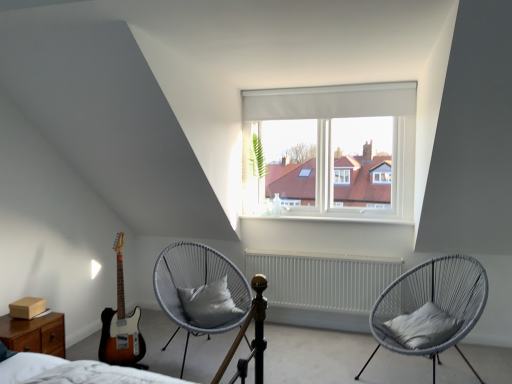
Question: Is sunburst wood guitar at left turned away from gray woven chair at center, the first chair when ordered from right to left?

Choices:
 (A) no
 (B) yes

Answer: (A)

Question: Does sunburst wood guitar at left contain gray woven chair at center, which is counted as the second chair, starting from the left?

Choices:
 (A) yes
 (B) no

Answer: (B)

Question: Does sunburst wood guitar at left lie in front of gray woven chair at center, the first chair when ordered from right to left?

Choices:
 (A) yes
 (B) no

Answer: (B)

Question: Is sunburst wood guitar at left oriented towards gray woven chair at center, the first chair when ordered from right to left?

Choices:
 (A) no
 (B) yes

Answer: (A)

Question: Does sunburst wood guitar at left have a greater height compared to gray woven chair at center, the first chair when ordered from right to left?

Choices:
 (A) yes
 (B) no

Answer: (A)

Question: Is point (182, 271) closer or farther from the camera than point (236, 311)?

Choices:
 (A) farther
 (B) closer

Answer: (A)

Question: From the image's perspective, relative to gray fabric pillow at center, marked as the 2th pillow in a right-to-left arrangement, is gray woven chair with cushion at center, acting as the 1th chair starting from the left, above or below?

Choices:
 (A) above
 (B) below

Answer: (B)

Question: In terms of width, does gray woven chair with cushion at center, acting as the 1th chair starting from the left, look wider or thinner when compared to gray fabric pillow at center, which is the 1th pillow in back-to-front order?

Choices:
 (A) wide
 (B) thin

Answer: (A)

Question: Is gray woven chair with cushion at center, acting as the 1th chair starting from the left, bigger or smaller than gray fabric pillow at center, which is the 1th pillow from left to right?

Choices:
 (A) small
 (B) big

Answer: (B)

Question: From the image's perspective, is gray fabric pillow at center, which is the 1th pillow from left to right, located above or below gray woven chair with cushion at center, the 2th chair when ordered from right to left?

Choices:
 (A) above
 (B) below

Answer: (A)

Question: From a real-world perspective, is gray fabric pillow at center, which is the 1th pillow in back-to-front order, positioned above or below gray woven chair with cushion at center, the 2th chair when ordered from right to left?

Choices:
 (A) above
 (B) below

Answer: (A)

Question: Considering their positions, is gray fabric pillow at center, which is the 1th pillow from left to right, located in front of or behind gray woven chair with cushion at center, the 2th chair when ordered from right to left?

Choices:
 (A) front
 (B) behind

Answer: (B)

Question: Looking at the image, does gray fabric pillow at center, which is the 1th pillow in back-to-front order, seem bigger or smaller compared to gray woven chair with cushion at center, acting as the 1th chair starting from the left?

Choices:
 (A) small
 (B) big

Answer: (A)

Question: Would you say gray fabric pillow at center, positioned as the second pillow in front-to-back order, is to the left or to the right of brown wood nightstand at lower left in the picture?

Choices:
 (A) right
 (B) left

Answer: (A)

Question: From the image's perspective, is gray fabric pillow at center, which is the 1th pillow in back-to-front order, above or below brown wood nightstand at lower left?

Choices:
 (A) above
 (B) below

Answer: (A)